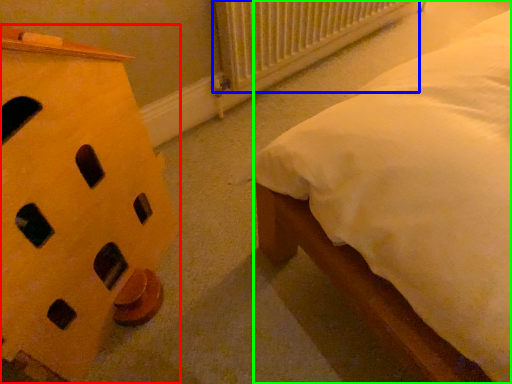
Question: Estimate the real-world distances between objects in this image. Which object is farther from furniture (highlighted by a red box), radiator (highlighted by a blue box) or nightstand (highlighted by a green box)?

Choices:
 (A) radiator
 (B) nightstand

Answer: (A)